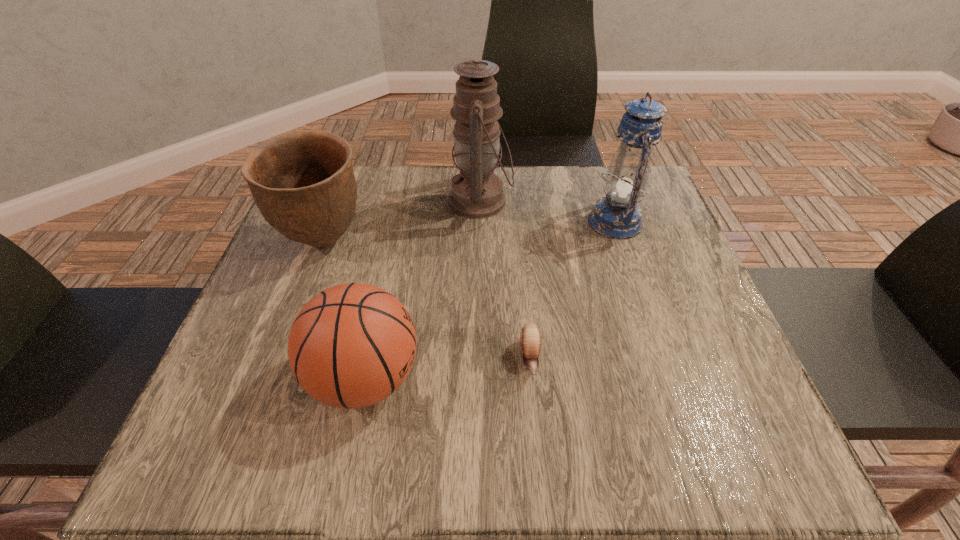
Locate an element on the screen. This screenshot has width=960, height=540. free area in between the pottery and the lantern is located at coordinates (469, 232).

The width and height of the screenshot is (960, 540). I want to click on unoccupied area between the pottery and the rightmost object, so click(469, 232).

Where is `vacant point located between the pottery and the shortest object`? Image resolution: width=960 pixels, height=540 pixels. vacant point located between the pottery and the shortest object is located at coordinates (427, 300).

At what (x,y) coordinates should I click in order to perform the action: click on free point between the basketball and the lantern. Please return your answer as a coordinate pair (x, y). The image size is (960, 540). Looking at the image, I should click on (491, 300).

Identify the location of free area in between the escargot and the pottery. (427, 300).

This screenshot has height=540, width=960. What are the coordinates of `vacant area between the lantern and the pottery` in the screenshot? It's located at (469, 232).

This screenshot has width=960, height=540. Identify the location of free space between the pottery and the escargot. (427, 300).

Point out which object is positioned as the second nearest to the oil lamp. Please provide its 2D coordinates. Your answer should be formatted as a tuple, i.e. [(x, y)], where the tuple contains the x and y coordinates of a point satisfying the conditions above.

[(617, 216)]

Select which object is the second closest to the escargot. Please provide its 2D coordinates. Your answer should be formatted as a tuple, i.e. [(x, y)], where the tuple contains the x and y coordinates of a point satisfying the conditions above.

[(617, 216)]

Image resolution: width=960 pixels, height=540 pixels. I want to click on vacant space that satisfies the following two spatial constraints: 1. on the front-facing side of the lantern; 2. on the front-facing side of the escargot, so click(660, 359).